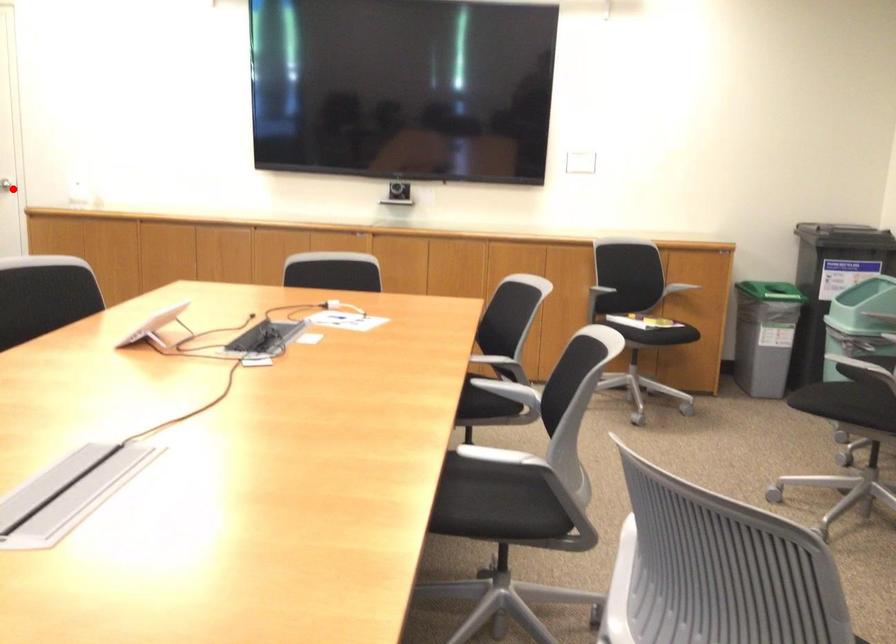
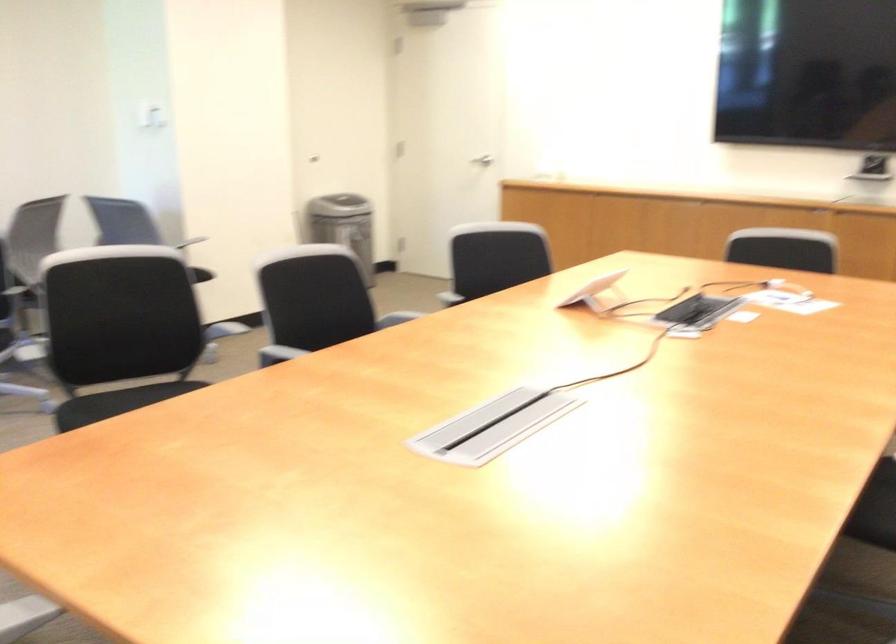
Question: I am providing you with two images of the same scene from different viewpoints. A red point is marked on the first image. Can you still see the location of the red point in image 2?

Choices:
 (A) Yes
 (B) No

Answer: (B)